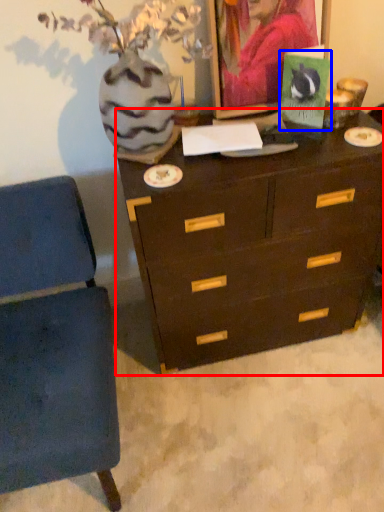
Question: Which object is further to the camera taking this photo, chest of drawers (highlighted by a red box) or postcard (highlighted by a blue box)?

Choices:
 (A) chest of drawers
 (B) postcard

Answer: (B)